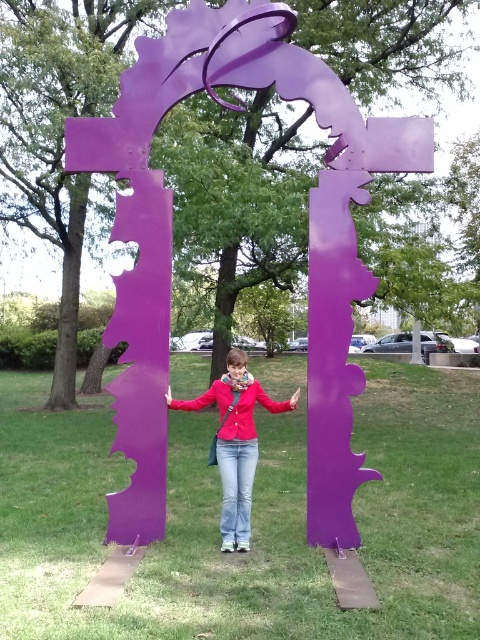
You are an art curator planning to photograph the purple metallic sculpture at center and the matte purple scarf at center. To ensure both are visible in the frame, which object should you position closer to the camera?

The purple metallic sculpture at center should be positioned closer to the camera since it is in front of the matte purple scarf at center, ensuring both are visible in the frame.

Based on the photo, you are standing in front of the purple sculpture and want to take a photo that captures both the person and the sculpture. You notice two points marked on your camera screen at coordinates point (10,547) and point (228,532). Which point should you focus on to ensure both the person and the sculpture are in focus?

You should focus on point (10,547) because it is closer to the camera than point (228,532), ensuring both the person and the sculpture are in focus.